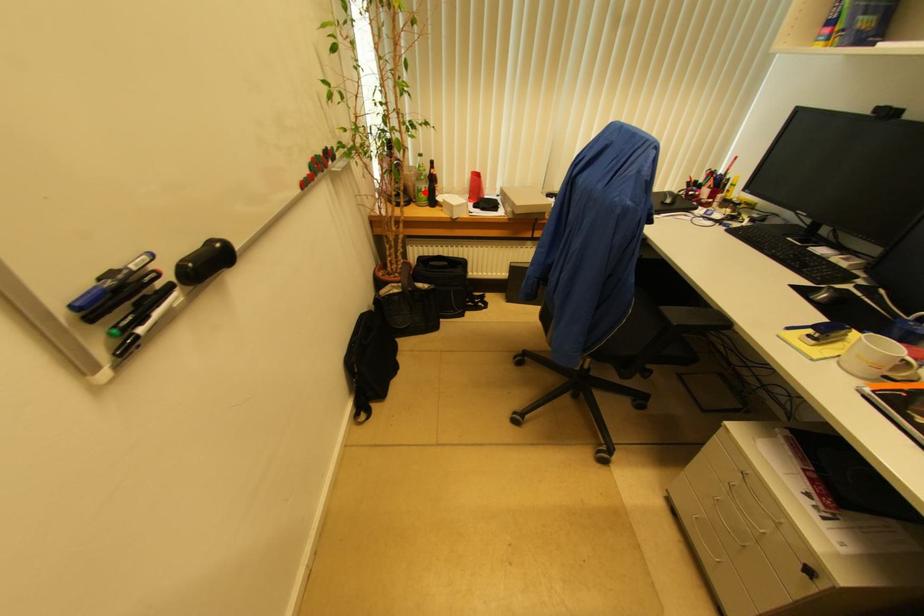
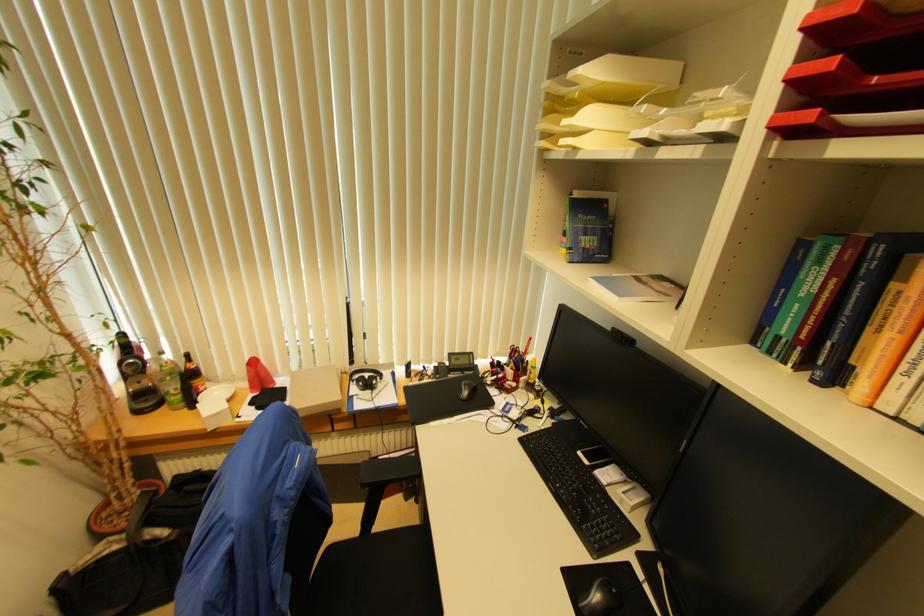
The point at the highlighted location is marked in the first image. Where is the corresponding point in the second image?

(174, 394)